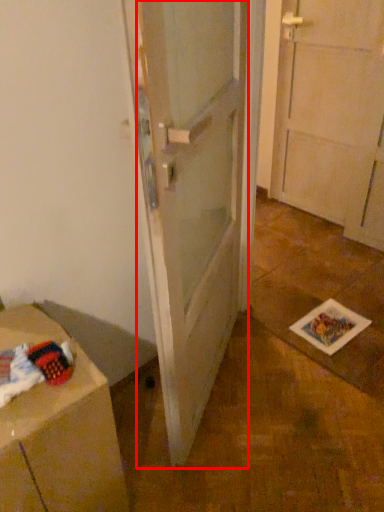
Question: From the image's perspective, what is the correct spatial relationship of door (annotated by the red box) in relation to cabinetry?

Choices:
 (A) above
 (B) below

Answer: (A)